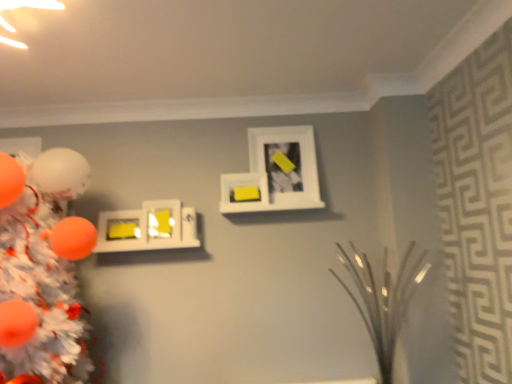
Question: Is orange matte christmas tree at left oriented towards matte yellow picture frame at center-left, arranged as the 2th picture frame when viewed from the left?

Choices:
 (A) no
 (B) yes

Answer: (A)

Question: Can you confirm if orange matte christmas tree at left is taller than matte yellow picture frame at center-left, arranged as the 2th picture frame when viewed from the left?

Choices:
 (A) no
 (B) yes

Answer: (B)

Question: From the image's perspective, would you say orange matte christmas tree at left is positioned over matte yellow picture frame at center-left, the 3th picture frame in the right-to-left sequence?

Choices:
 (A) yes
 (B) no

Answer: (B)

Question: Is orange matte christmas tree at left looking in the opposite direction of matte yellow picture frame at center-left, arranged as the 2th picture frame when viewed from the left?

Choices:
 (A) no
 (B) yes

Answer: (A)

Question: Does orange matte christmas tree at left come in front of matte yellow picture frame at center-left, the 3th picture frame in the right-to-left sequence?

Choices:
 (A) no
 (B) yes

Answer: (B)

Question: Looking at their shapes, would you say white matte picture frame at upper center, which appears as the 4th picture frame when viewed from the left, is wider or thinner than orange matte christmas tree at left?

Choices:
 (A) wide
 (B) thin

Answer: (B)

Question: From the image's perspective, is white matte picture frame at upper center, which appears as the 4th picture frame when viewed from the left, positioned above or below orange matte christmas tree at left?

Choices:
 (A) above
 (B) below

Answer: (A)

Question: In terms of height, does white matte picture frame at upper center, which appears as the 4th picture frame when viewed from the left, look taller or shorter compared to orange matte christmas tree at left?

Choices:
 (A) short
 (B) tall

Answer: (A)

Question: Is white matte picture frame at upper center, which appears as the 4th picture frame when viewed from the left, to the left or to the right of orange matte christmas tree at left in the image?

Choices:
 (A) right
 (B) left

Answer: (A)

Question: In terms of width, does yellow matte picture frame at upper center, arranged as the second picture frame when viewed from the right, look wider or thinner when compared to white matte picture frame at upper center, which appears as the 4th picture frame when viewed from the left?

Choices:
 (A) wide
 (B) thin

Answer: (B)

Question: From a real-world perspective, is yellow matte picture frame at upper center, the 3th picture frame positioned from the left, positioned above or below white matte picture frame at upper center, which is counted as the 1th picture frame, starting from the right?

Choices:
 (A) above
 (B) below

Answer: (B)

Question: From the image's perspective, relative to white matte picture frame at upper center, which appears as the 4th picture frame when viewed from the left, is yellow matte picture frame at upper center, arranged as the second picture frame when viewed from the right, above or below?

Choices:
 (A) above
 (B) below

Answer: (B)

Question: Considering the positions of yellow matte picture frame at upper center, arranged as the second picture frame when viewed from the right, and white matte picture frame at upper center, which appears as the 4th picture frame when viewed from the left, in the image, is yellow matte picture frame at upper center, arranged as the second picture frame when viewed from the right, taller or shorter than white matte picture frame at upper center, which appears as the 4th picture frame when viewed from the left,?

Choices:
 (A) short
 (B) tall

Answer: (A)

Question: Choose the correct answer: Is matte yellow picture frame at center-left, the 3th picture frame in the right-to-left sequence, inside yellow matte picture frame at upper center, arranged as the second picture frame when viewed from the right, or outside it?

Choices:
 (A) inside
 (B) outside

Answer: (B)

Question: From the image's perspective, is matte yellow picture frame at center-left, the 3th picture frame in the right-to-left sequence, positioned above or below yellow matte picture frame at upper center, the 3th picture frame positioned from the left?

Choices:
 (A) below
 (B) above

Answer: (A)